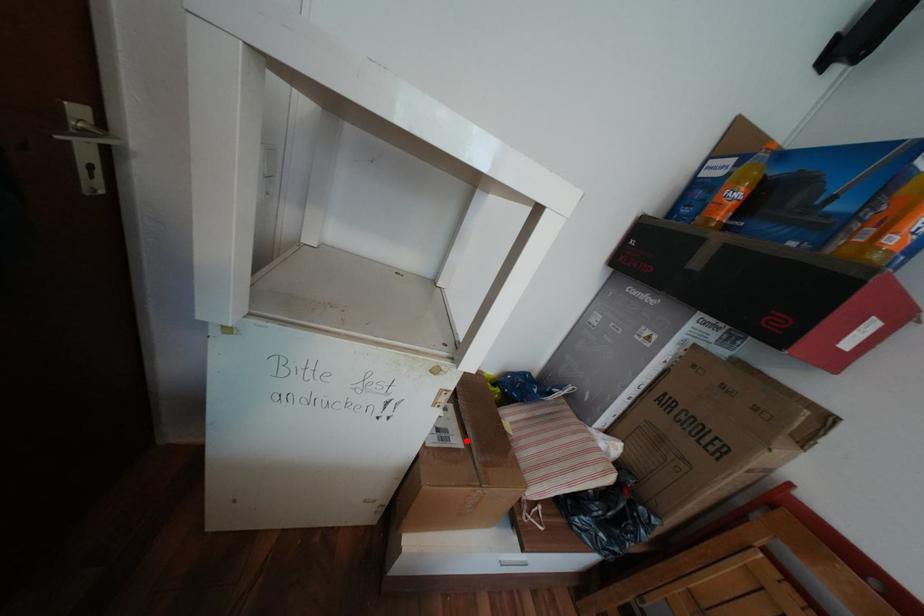
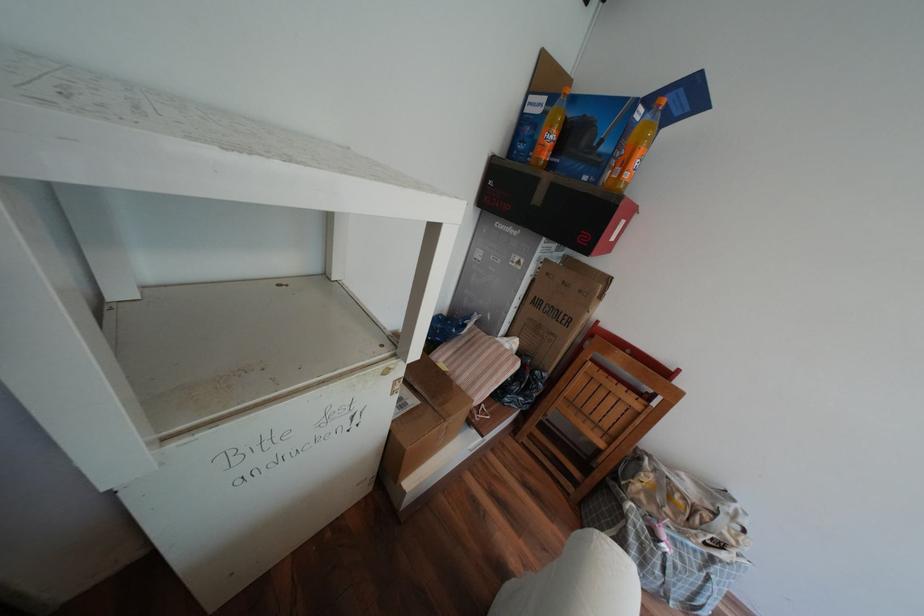
Where in the second image is the point corresponding to the highlighted location from the first image?

(422, 400)